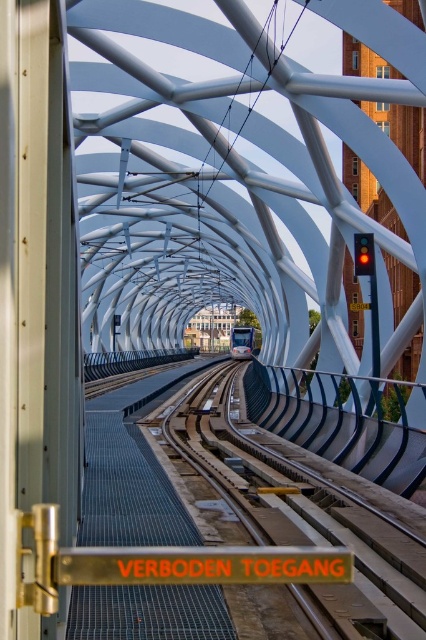
Consider the image. Can you confirm if metallic smooth train track at center is positioned to the right of matte blue train at center?

In fact, metallic smooth train track at center is to the left of matte blue train at center.

Does metallic smooth train track at center lie in front of matte blue train at center?

Yes, it is.

Who is more distant from viewer, [325,504] or [236,339]?

Positioned behind is point [236,339].

At what (x,y) coordinates should I click in order to perform the action: click on metallic smooth train track at center. Please return your answer as a coordinate pair (x, y). This screenshot has width=426, height=640. Looking at the image, I should click on (307, 512).